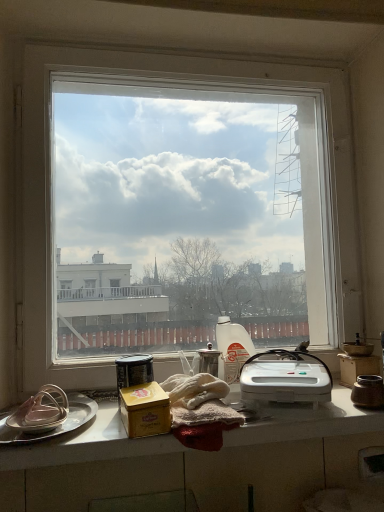
The width and height of the screenshot is (384, 512). I want to click on vacant area that lies between silver metallic platter at left and gold matte tin at center, the 3th appliance in the left-to-right sequence, so click(x=102, y=428).